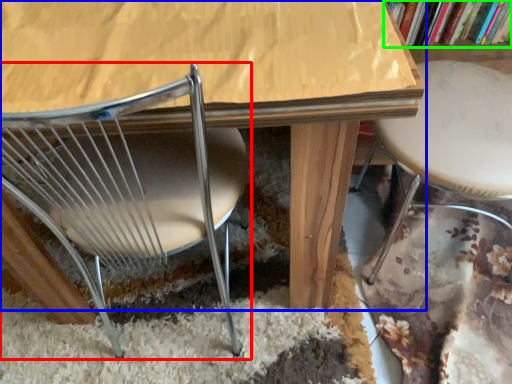
Question: Which object is positioned closest to chair (highlighted by a red box)? Select from table (highlighted by a blue box) and book (highlighted by a green box).

Choices:
 (A) table
 (B) book

Answer: (A)